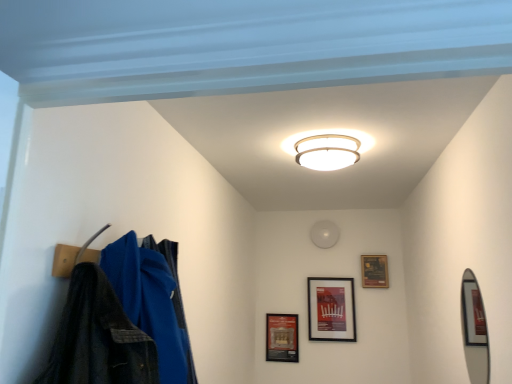
Question: Does silver metallic mirror at right have a smaller size compared to white glossy ceiling light at center?

Choices:
 (A) yes
 (B) no

Answer: (A)

Question: Would you consider silver metallic mirror at right to be distant from white glossy ceiling light at center?

Choices:
 (A) yes
 (B) no

Answer: (B)

Question: Is silver metallic mirror at right shorter than white glossy ceiling light at center?

Choices:
 (A) yes
 (B) no

Answer: (B)

Question: Considering the relative sizes of silver metallic mirror at right and white glossy ceiling light at center in the image provided, is silver metallic mirror at right thinner than white glossy ceiling light at center?

Choices:
 (A) no
 (B) yes

Answer: (B)

Question: From the image's perspective, is silver metallic mirror at right under white glossy ceiling light at center?

Choices:
 (A) yes
 (B) no

Answer: (A)

Question: Is silver metallic mirror at right at the left side of white glossy ceiling light at center?

Choices:
 (A) yes
 (B) no

Answer: (B)

Question: Is there a large distance between matte brown picture frame at upper right, the 1th picture frame viewed from the right, and white glossy ceiling light at center?

Choices:
 (A) no
 (B) yes

Answer: (B)

Question: Does matte brown picture frame at upper right, the 1th picture frame viewed from the right, have a greater height compared to white glossy ceiling light at center?

Choices:
 (A) no
 (B) yes

Answer: (B)

Question: From the image's perspective, would you say matte brown picture frame at upper right, the 1th picture frame viewed from the right, is shown under white glossy ceiling light at center?

Choices:
 (A) yes
 (B) no

Answer: (A)

Question: Is matte brown picture frame at upper right, the 1th picture frame viewed from the right, aimed at white glossy ceiling light at center?

Choices:
 (A) yes
 (B) no

Answer: (A)

Question: Is matte brown picture frame at upper right, the 1th picture frame viewed from the right, looking in the opposite direction of white glossy ceiling light at center?

Choices:
 (A) yes
 (B) no

Answer: (B)

Question: Is white glossy ceiling light at center surrounded by matte brown picture frame at upper right, which ranks as the third picture frame in left-to-right order?

Choices:
 (A) yes
 (B) no

Answer: (B)

Question: Does white glossy ceiling light at center touch matte brown picture frame at upper right, which ranks as the third picture frame in left-to-right order?

Choices:
 (A) no
 (B) yes

Answer: (A)